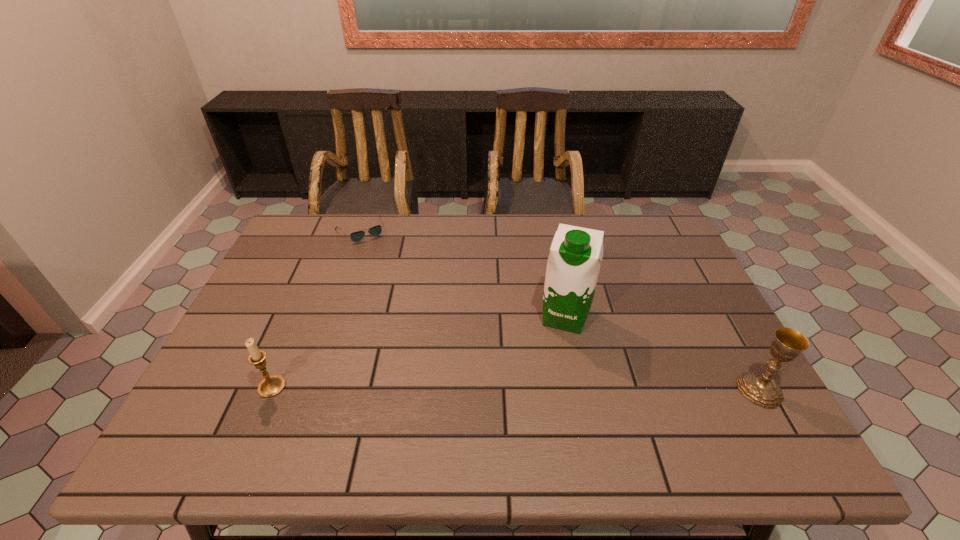
The width and height of the screenshot is (960, 540). I want to click on vacant space situated on the front-facing side of the soya milk, so click(542, 400).

The image size is (960, 540). Identify the location of vacant space located 0.310m on the lenses of the shortest object. (407, 301).

Locate an element on the screen. This screenshot has height=540, width=960. free region located 0.180m on the lenses of the shortest object is located at coordinates (390, 274).

At what (x,y) coordinates should I click in order to perform the action: click on free location located 0.270m on the lenses of the shortest object. Please return your answer as a coordinate pair (x, y). This screenshot has width=960, height=540. Looking at the image, I should click on (401, 292).

Find the location of a particular element. The image size is (960, 540). object present at the far edge is located at coordinates (357, 236).

Where is `candle holder located at the near edge`? candle holder located at the near edge is located at coordinates (270, 386).

Find the location of `chalice present at the near edge`. chalice present at the near edge is located at coordinates (760, 388).

Find the location of `candle holder present at the left edge`. candle holder present at the left edge is located at coordinates (270, 386).

You are a GUI agent. You are given a task and a screenshot of the screen. Output one action in this format:
    pyautogui.click(x=<x>, y=<y>)
    Task: Click on the sunglasses that is at the left edge
    The height and width of the screenshot is (540, 960).
    Given the screenshot: What is the action you would take?
    pyautogui.click(x=357, y=236)

Image resolution: width=960 pixels, height=540 pixels. Identify the location of object situated at the right edge. (760, 388).